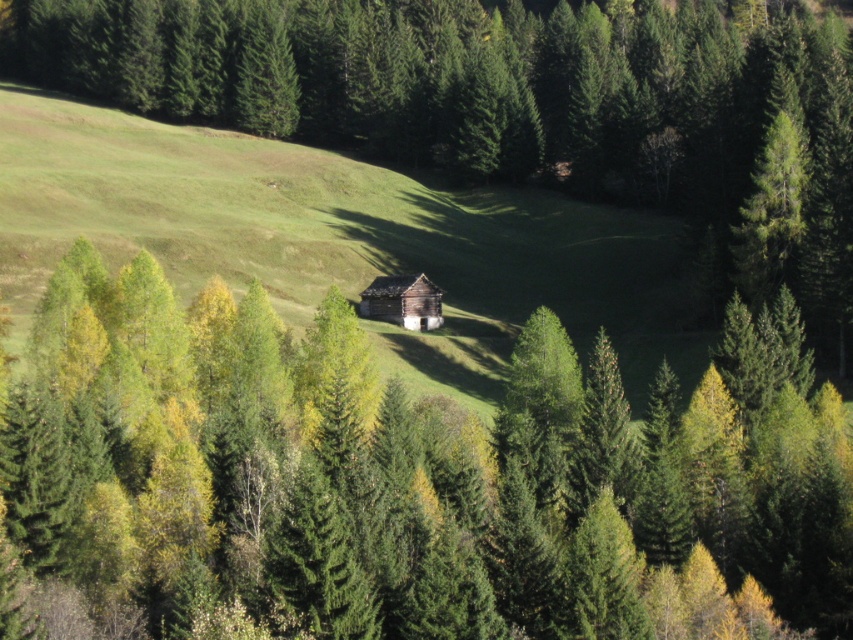
You are planning to build a small garden between the green matte tree at center and the wooden log cabin at center. Considering their sizes, which one will require more space to accommodate the garden?

The green matte tree at center is larger in size than the wooden log cabin at center, so it will require more space to accommodate the garden.